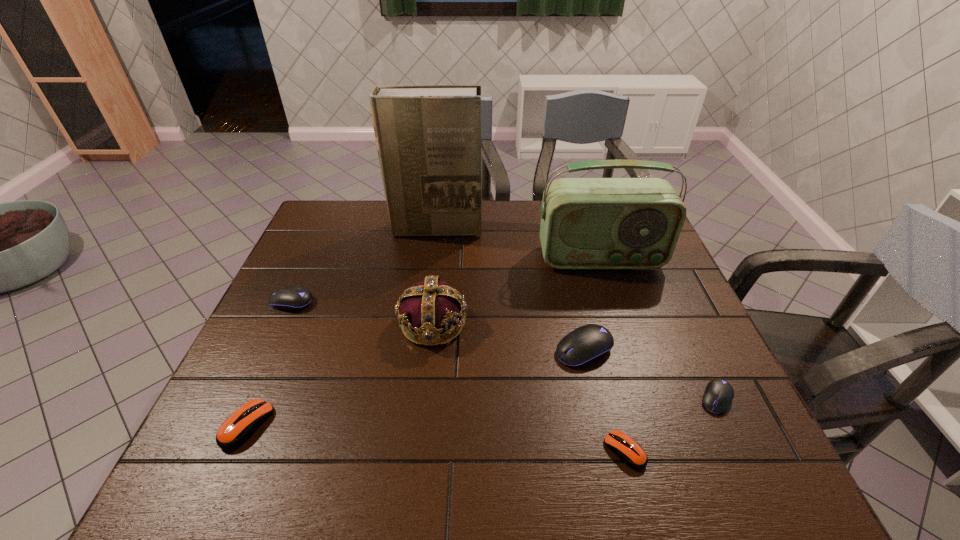
This screenshot has width=960, height=540. In order to click on blank area located 0.190m on the back of the bigger orange computer mouse in this screenshot , I will do `click(287, 335)`.

Where is `free region located on the back of the smallest black computer mouse`? This screenshot has width=960, height=540. free region located on the back of the smallest black computer mouse is located at coordinates (674, 308).

What are the coordinates of `vacant space located 0.190m on the left of the right orange computer mouse` in the screenshot? It's located at (510, 451).

Find the location of a particular element. object that is at the far edge is located at coordinates (428, 137).

At what (x,y) coordinates should I click in order to perform the action: click on radio receiver present at the right edge. Please return your answer as a coordinate pair (x, y). The width and height of the screenshot is (960, 540). Looking at the image, I should click on (586, 223).

I want to click on computer mouse that is at the right edge, so click(718, 395).

At what (x,y) coordinates should I click in order to perform the action: click on object that is at the near left corner. Please return your answer as a coordinate pair (x, y). This screenshot has height=540, width=960. Looking at the image, I should click on (241, 425).

Find the location of a particular element. free space at the far edge of the desktop is located at coordinates (494, 204).

In the image, there is a desktop. At what (x,y) coordinates should I click in order to perform the action: click on blank space at the near edge. Please return your answer as a coordinate pair (x, y). The width and height of the screenshot is (960, 540). Looking at the image, I should click on (288, 449).

The height and width of the screenshot is (540, 960). In the image, there is a desktop. Identify the location of free space at the left edge. (298, 259).